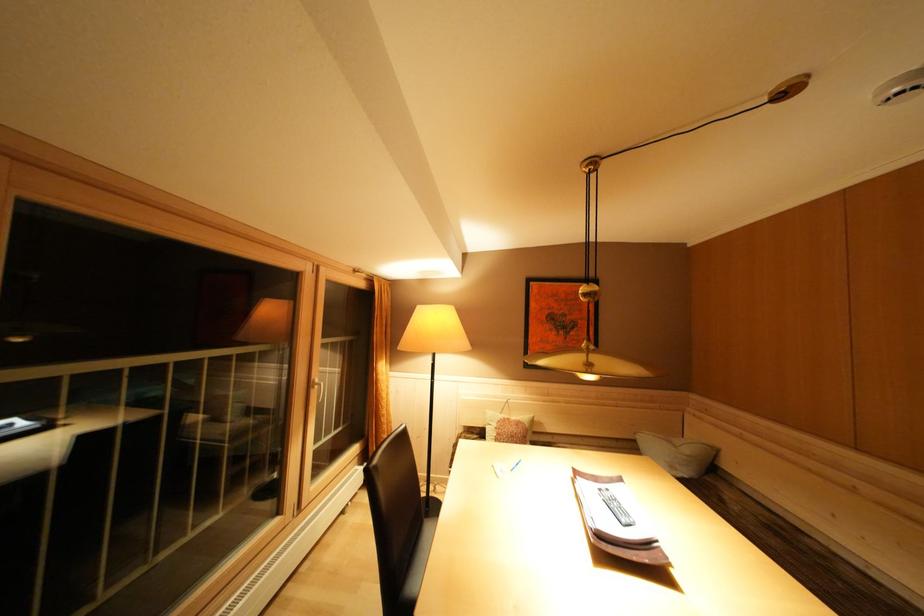
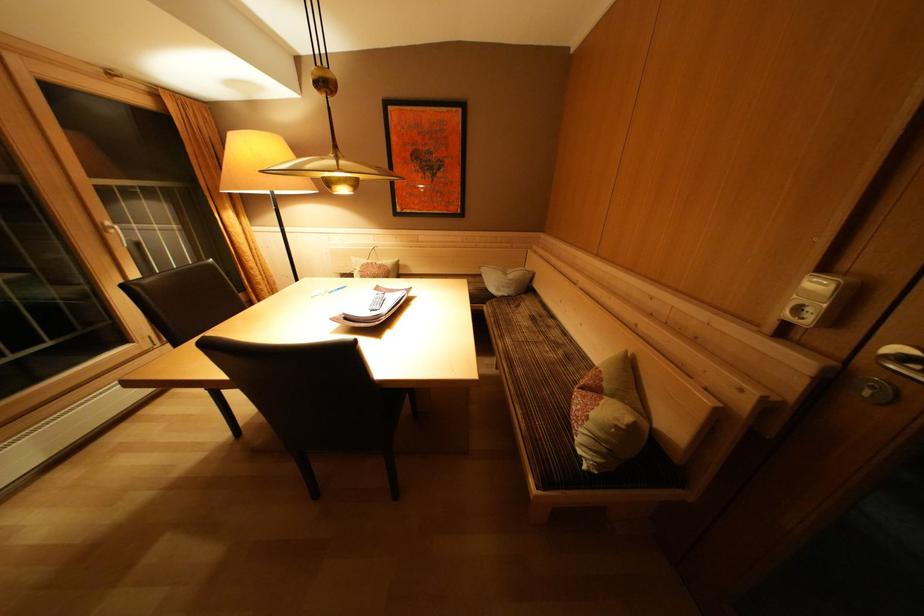
In the second image, find the point that corresponds to the point at 515,424 in the first image.

(379, 268)